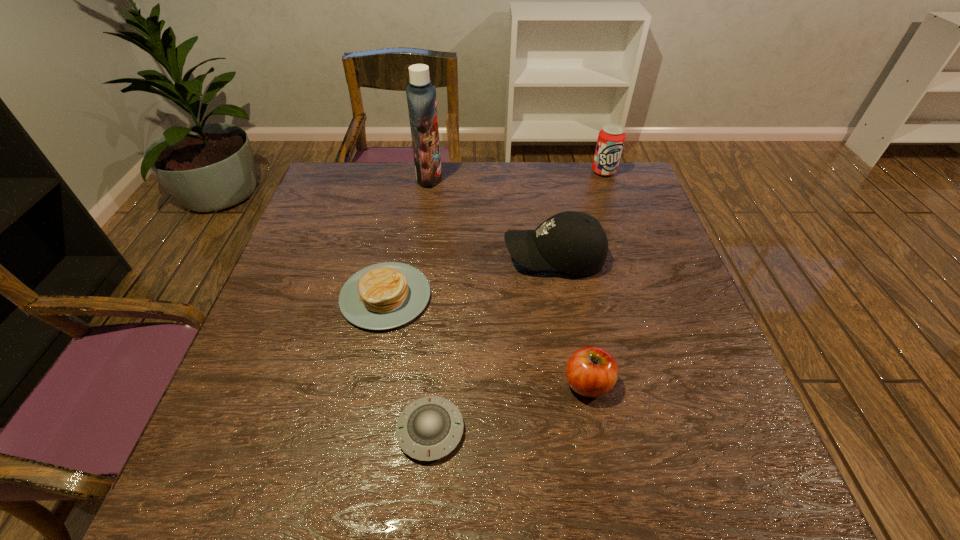
What are the coordinates of `vacant space situated 0.240m on the front-facing side of the baseball cap` in the screenshot? It's located at (409, 257).

Identify the location of vacant space located on the left of the apple. (361, 383).

At what (x,y) coordinates should I click in order to perform the action: click on vacant space situated 0.310m on the front of the pancake. Please return your answer as a coordinate pair (x, y). Image resolution: width=960 pixels, height=540 pixels. Looking at the image, I should click on (349, 481).

The height and width of the screenshot is (540, 960). Find the location of `free space located 0.320m on the back of the shortest object`. free space located 0.320m on the back of the shortest object is located at coordinates (443, 280).

Identify the location of shampoo at the far edge. (421, 96).

Identify the location of soda can that is at the far edge. (611, 137).

Image resolution: width=960 pixels, height=540 pixels. Find the location of `object present at the near edge`. object present at the near edge is located at coordinates (429, 428).

In order to click on object at the right edge in this screenshot , I will do `click(611, 137)`.

Where is `object that is at the far right corner`? The width and height of the screenshot is (960, 540). object that is at the far right corner is located at coordinates (611, 137).

Where is `free space at the far edge of the desktop`? The width and height of the screenshot is (960, 540). free space at the far edge of the desktop is located at coordinates [x=492, y=177].